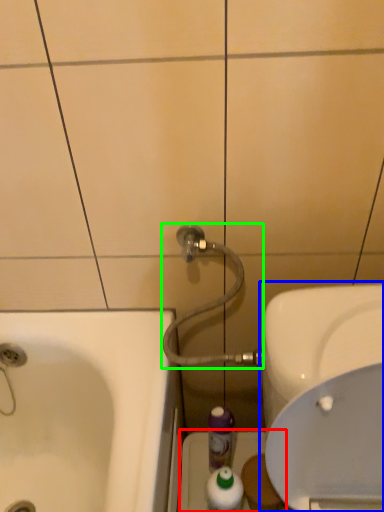
Question: Based on their relative distances, which object is farther from porcelain (highlighted by a red box)? Choose from sink (highlighted by a blue box) and shower (highlighted by a green box).

Choices:
 (A) sink
 (B) shower

Answer: (A)